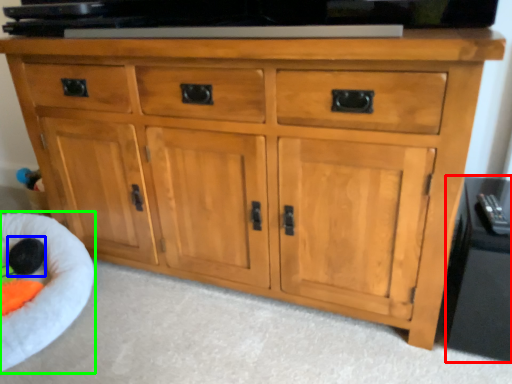
Question: Which is farther away from side cabinet (highlighted by a red box)? toy (highlighted by a blue box) or infant bed (highlighted by a green box)?

Choices:
 (A) toy
 (B) infant bed

Answer: (A)